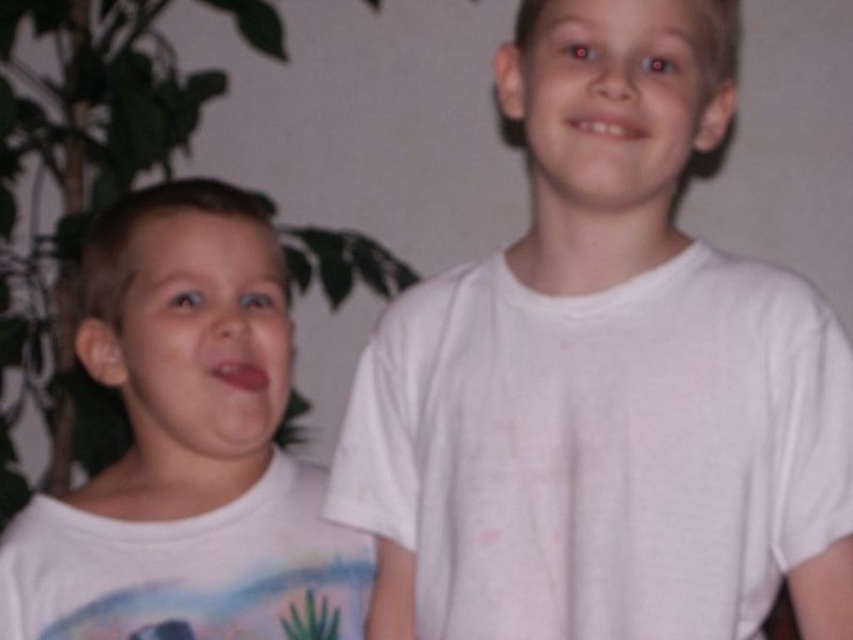
You are a tailor who needs to determine which shirt can accommodate a larger patch without distorting its shape. Based on the image, which shirt between the white cotton shirt at center and the white matte shirt at left would be more suitable?

The white cotton shirt at center is larger in size than the white matte shirt at left, so it can accommodate a larger patch without distorting its shape.

Based on the photo, you are a photographer setting up for a photoshoot. You need to ensure that the white cotton shirt at center and the white matte shirt at left are arranged so that the cotton shirt is to the right of the matte shirt. Is the current arrangement correct?

Yes, the current arrangement is correct because the white cotton shirt at center is positioned on the right side of the white matte shirt at left.